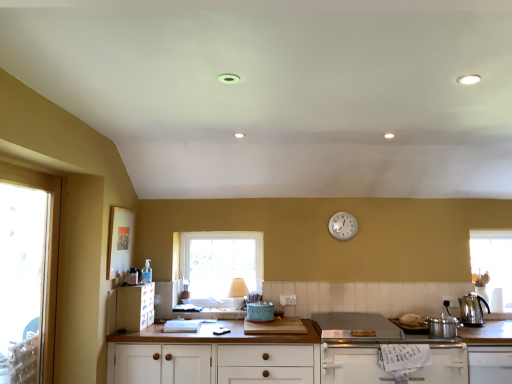
The image size is (512, 384). What do you see at coordinates (220, 262) in the screenshot?
I see `clear glass window at center, which appears as the second window when viewed from the left` at bounding box center [220, 262].

You are a GUI agent. You are given a task and a screenshot of the screen. Output one action in this format:
    pyautogui.click(x=<x>, y=<y>)
    Task: Click on the white metallic clock at upper center
    The image size is (512, 384).
    Given the screenshot: What is the action you would take?
    pyautogui.click(x=343, y=226)

Describe the element at coordinates (370, 329) in the screenshot. I see `stainless steel cooktop at lower center` at that location.

What do you see at coordinates (260, 311) in the screenshot?
I see `teal ceramic toaster at center, the 2th appliance in the right-to-left sequence` at bounding box center [260, 311].

At what (x,y) coordinates should I click in order to perform the action: click on white matte cabinet at lower right, which is counted as the second cabinetry, starting from the right. Please return your answer as a coordinate pair (x, y). This screenshot has width=512, height=384. Looking at the image, I should click on (352, 364).

What are the coordinates of `clear glass window at center, the first window from the right` in the screenshot? It's located at (220, 262).

Considering the relative sizes of matte plastic cabinet at lower left, marked as the 4th cabinetry in a right-to-left arrangement, and stainless steel kettle at right in the image provided, is matte plastic cabinet at lower left, marked as the 4th cabinetry in a right-to-left arrangement, bigger than stainless steel kettle at right?

Yes, matte plastic cabinet at lower left, marked as the 4th cabinetry in a right-to-left arrangement, is bigger than stainless steel kettle at right.

Looking at their sizes, would you say matte plastic cabinet at lower left, the first cabinetry positioned from the left, is wider or thinner than stainless steel kettle at right?

Considering their sizes, matte plastic cabinet at lower left, the first cabinetry positioned from the left, looks broader than stainless steel kettle at right.

Between matte plastic cabinet at lower left, marked as the 4th cabinetry in a right-to-left arrangement, and stainless steel kettle at right, which one has less height?

stainless steel kettle at right is shorter.

Which is closer, (152,303) or (503,325)?

The point (503,325) is more forward.

Which object is positioned more to the right, matte plastic cabinet at lower left, the first cabinetry positioned from the left, or silver metallic pot at lower right, the 4th cabinetry in the left-to-right sequence?

Result: Positioned to the right is silver metallic pot at lower right, the 4th cabinetry in the left-to-right sequence.

Is matte plastic cabinet at lower left, the first cabinetry positioned from the left, positioned beyond the bounds of silver metallic pot at lower right, the 4th cabinetry in the left-to-right sequence?

Absolutely, matte plastic cabinet at lower left, the first cabinetry positioned from the left, is external to silver metallic pot at lower right, the 4th cabinetry in the left-to-right sequence.

Considering the sizes of objects clear glass window at center, which appears as the second window when viewed from the left, and stainless steel kettle at right in the image provided, who is smaller, clear glass window at center, which appears as the second window when viewed from the left, or stainless steel kettle at right?

With smaller size is stainless steel kettle at right.

Between clear glass window at center, arranged as the 1th window when viewed from the back, and stainless steel kettle at right, which one is positioned behind?

clear glass window at center, arranged as the 1th window when viewed from the back, is further from the camera.

Find the location of a particular element. This screenshot has width=512, height=384. kitchen appliance located on the right of clear glass window at center, which is the 2th window from front to back is located at coordinates (472, 309).

Based on the photo, who is taller, clear glass window at center, the first window from the right, or stainless steel kettle at right?

clear glass window at center, the first window from the right.

Is point (249, 263) less distant than point (381, 337)?

No.

Does clear glass window at center, the first window from the right, come behind stainless steel cooktop at lower center?

That is True.

Does clear glass window at center, the first window from the right, have a greater width compared to stainless steel cooktop at lower center?

No.

In the image, is white wood cabinet at center, positioned as the third cabinetry in right-to-left order, positioned in front of or behind white metallic clock at upper center?

In the image, white wood cabinet at center, positioned as the third cabinetry in right-to-left order, appears in front of white metallic clock at upper center.

Could you tell me if white wood cabinet at center, the second cabinetry from the left, is turned towards white metallic clock at upper center?

No, white wood cabinet at center, the second cabinetry from the left, is not turned towards white metallic clock at upper center.

Would you say white metallic clock at upper center is part of white wood cabinet at center, the second cabinetry from the left,'s contents?

No, white metallic clock at upper center is not inside white wood cabinet at center, the second cabinetry from the left.

Does white wood cabinet at center, positioned as the third cabinetry in right-to-left order, have a greater width compared to white metallic clock at upper center?

Yes, white wood cabinet at center, positioned as the third cabinetry in right-to-left order, is wider than white metallic clock at upper center.

Considering the points (33, 179) and (344, 217), which point is in front, point (33, 179) or point (344, 217)?

The point (33, 179) is more forward.

Does transparent glass window at left, the 2th window positioned from the back, turn towards white metallic clock at upper center?

No, transparent glass window at left, the 2th window positioned from the back, does not turn towards white metallic clock at upper center.

Is transparent glass window at left, arranged as the 2th window when viewed from the right, with white metallic clock at upper center?

No, transparent glass window at left, arranged as the 2th window when viewed from the right, is not with white metallic clock at upper center.

From a real-world perspective, relative to white metallic clock at upper center, is teal ceramic toaster at center, the 2th appliance in the right-to-left sequence, vertically above or below?

teal ceramic toaster at center, the 2th appliance in the right-to-left sequence, is below white metallic clock at upper center.

Which object is wider, teal ceramic toaster at center, which is the first appliance in left-to-right order, or white metallic clock at upper center?

With larger width is teal ceramic toaster at center, which is the first appliance in left-to-right order.

Who is taller, teal ceramic toaster at center, the 2th appliance in the right-to-left sequence, or white metallic clock at upper center?

Standing taller between the two is white metallic clock at upper center.

Where is `kitchen appliance located below the matte plastic cabinet at lower left, the first cabinetry positioned from the left (from the image's perspective)`? The height and width of the screenshot is (384, 512). kitchen appliance located below the matte plastic cabinet at lower left, the first cabinetry positioned from the left (from the image's perspective) is located at coordinates click(472, 309).

The height and width of the screenshot is (384, 512). I want to click on cabinetry that is the 3rd one when counting leftward from the silver metallic pot at lower right, the 4th cabinetry in the left-to-right sequence, so click(135, 307).

Which object lies further to the anchor point white metallic clock at upper center, matte plastic cabinet at lower left, marked as the 4th cabinetry in a right-to-left arrangement, or transparent glass window at left, the 1th window when ordered from left to right?

transparent glass window at left, the 1th window when ordered from left to right.

Considering their positions, is matte plastic cabinet at lower left, the first cabinetry positioned from the left, positioned further to silver metallic pot at lower right, the 4th cabinetry in the left-to-right sequence, than stainless steel cooktop at lower center?

Based on the image, matte plastic cabinet at lower left, the first cabinetry positioned from the left, appears to be further to silver metallic pot at lower right, the 4th cabinetry in the left-to-right sequence.

From the image, which object appears to be farther from silver metallic pot at lower right, the first cabinetry when ordered from right to left, matte plastic cabinet at lower left, the first cabinetry positioned from the left, or teal ceramic toaster at center, the 2th appliance from the front?

matte plastic cabinet at lower left, the first cabinetry positioned from the left, lies further to silver metallic pot at lower right, the first cabinetry when ordered from right to left, than the other object.

Estimate the real-world distances between objects in this image. Which object is closer to white matte cabinet at lower right, placed as the third cabinetry when sorted from left to right, stainless steel cooktop at lower center or clear glass window at center, the first window from the right?

stainless steel cooktop at lower center is positioned closer to the anchor white matte cabinet at lower right, placed as the third cabinetry when sorted from left to right.

Estimate the real-world distances between objects in this image. Which object is further from stainless steel cooktop at lower center, white matte cabinet at lower right, which is counted as the second cabinetry, starting from the right, or white wood cabinet at center, positioned as the third cabinetry in right-to-left order?

The object further to stainless steel cooktop at lower center is white wood cabinet at center, positioned as the third cabinetry in right-to-left order.

From the image, which object appears to be farther from white metallic clock at upper center, clear glass window at center, the first window from the right, or transparent glass window at left, the 1th window when ordered from left to right?

Based on the image, transparent glass window at left, the 1th window when ordered from left to right, appears to be further to white metallic clock at upper center.

From the image, which object appears to be farther from white matte cabinet at lower right, placed as the third cabinetry when sorted from left to right, clear glass window at center, which is the 2th window from front to back, or stainless steel cooktop at lower center?

clear glass window at center, which is the 2th window from front to back.

When comparing their distances from metallic silver pot at right, which is counted as the 2th appliance, starting from the left, does clear glass window at center, the first window from the right, or stainless steel kettle at right seem closer?

Among the two, stainless steel kettle at right is located nearer to metallic silver pot at right, which is counted as the 2th appliance, starting from the left.

I want to click on gas stove between clear glass window at center, arranged as the 1th window when viewed from the back, and metallic silver pot at right, placed as the 1th appliance when sorted from right to left, in the horizontal direction, so click(x=370, y=329).

What are the coordinates of `appliance between matte plastic cabinet at lower left, marked as the 4th cabinetry in a right-to-left arrangement, and stainless steel cooktop at lower center from left to right` in the screenshot? It's located at (260, 311).

The image size is (512, 384). I want to click on clock located between matte plastic cabinet at lower left, the first cabinetry positioned from the left, and stainless steel cooktop at lower center in the left-right direction, so click(x=343, y=226).

Where is `kitchen appliance between transparent glass window at left, which is the 1th window in front-to-back order, and silver metallic pot at lower right, the first cabinetry when ordered from right to left, in the horizontal direction`? kitchen appliance between transparent glass window at left, which is the 1th window in front-to-back order, and silver metallic pot at lower right, the first cabinetry when ordered from right to left, in the horizontal direction is located at coordinates (472, 309).